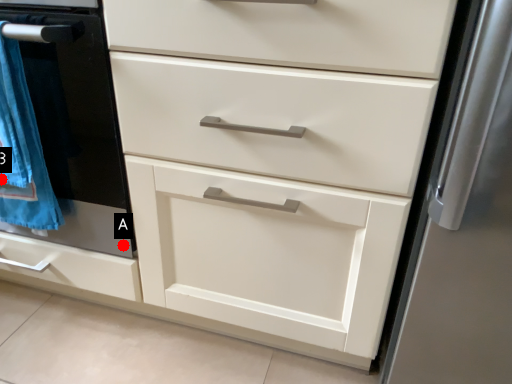
Question: Two points are circled on the image, labeled by A and B beside each circle. Which of the following is the closest to the observer?

Choices:
 (A) A is closer
 (B) B is closer

Answer: (B)